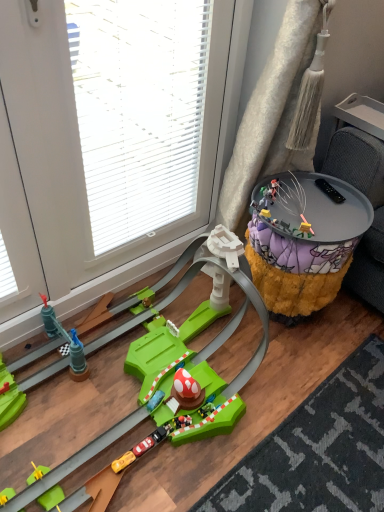
Question: Which is correct: shaggy yellow ottoman at right is inside metallic gold figure at center-right, the 2th toy when ordered from left to right, or outside of it?

Choices:
 (A) outside
 (B) inside

Answer: (A)

Question: Is shaggy yellow ottoman at right taller or shorter than metallic gold figure at center-right, acting as the 1th toy starting from the top?

Choices:
 (A) tall
 (B) short

Answer: (A)

Question: Based on their relative distances, which object is nearer to the shaggy yellow ottoman at right?

Choices:
 (A) transparent plastic glass door at upper left
 (B) metallic gold figure at center-right, placed as the second toy when sorted from bottom to top
 (C) green plastic race track at lower left, the 1th toy positioned from the front

Answer: (B)

Question: Which of these objects is positioned farthest from the shaggy yellow ottoman at right?

Choices:
 (A) metallic gold figure at center-right, placed as the second toy when sorted from bottom to top
 (B) green plastic race track at lower left, arranged as the 1th toy when ordered from the bottom
 (C) transparent plastic glass door at upper left

Answer: (C)